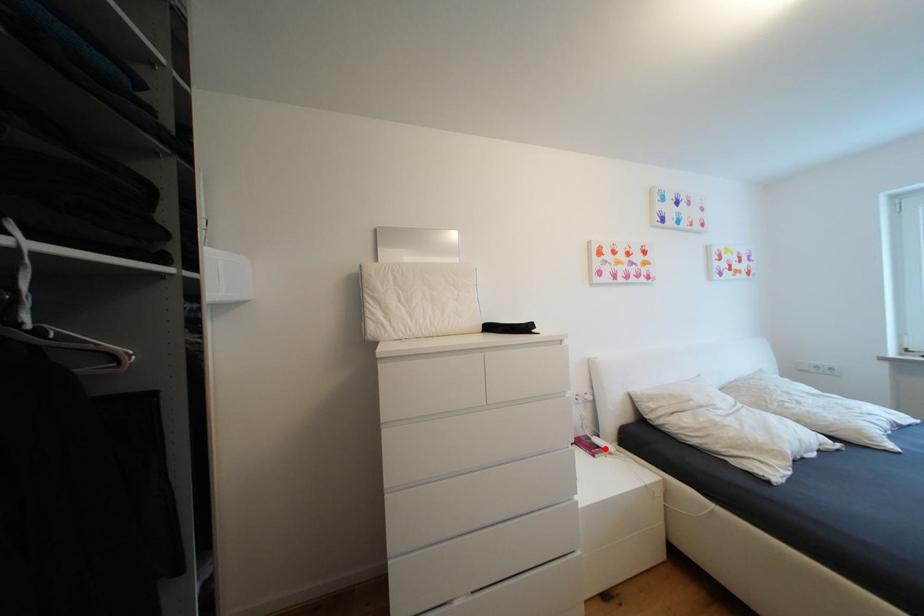
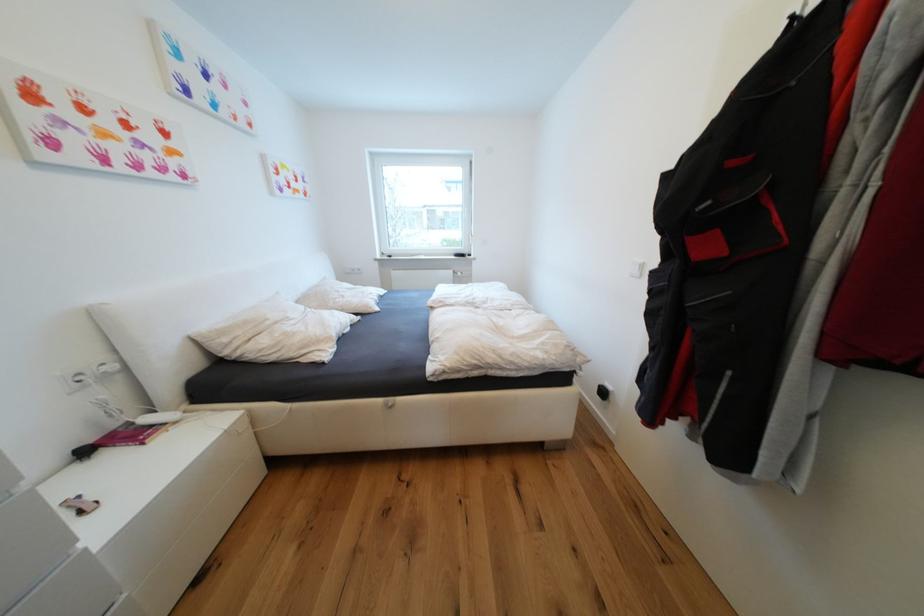
In the second image, find the point that corresponds to the highlighted location in the first image.

(159, 428)